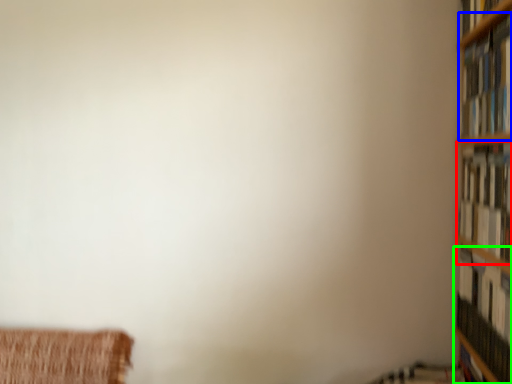
Question: Which is farther away from book (highlighted by a red box)? book (highlighted by a blue box) or book (highlighted by a green box)?

Choices:
 (A) book
 (B) book

Answer: (B)